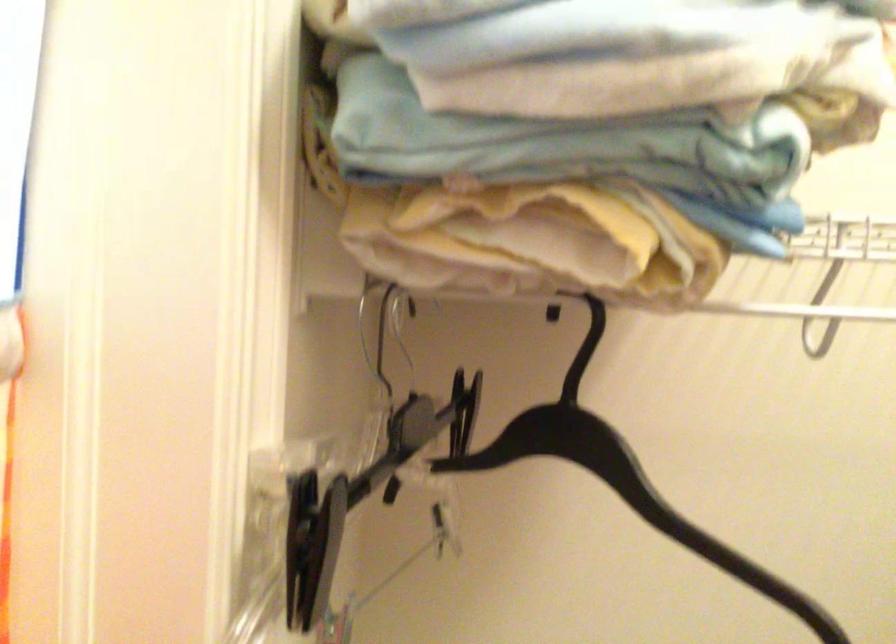
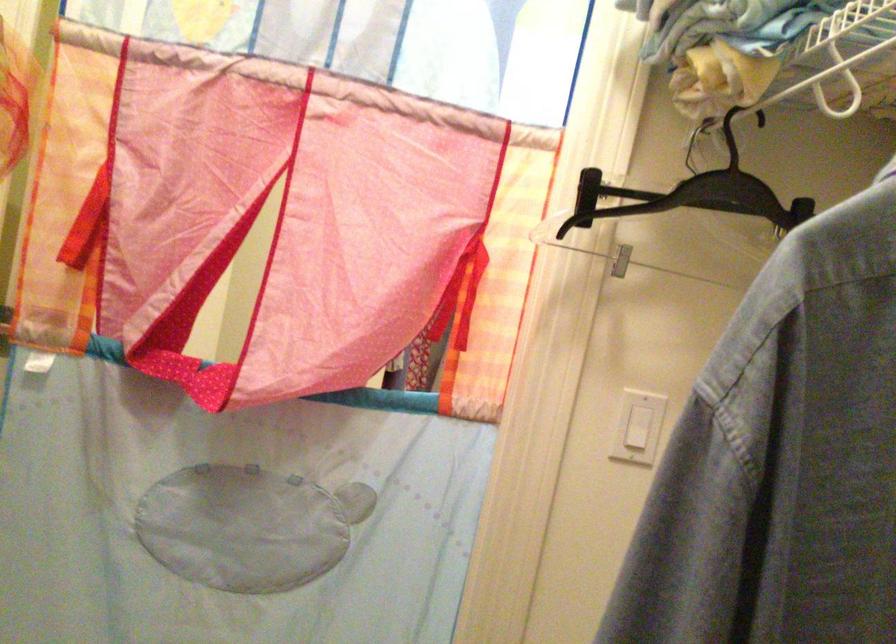
Where in the second image is the point corresponding to the point at 521,455 from the first image?

(693, 194)